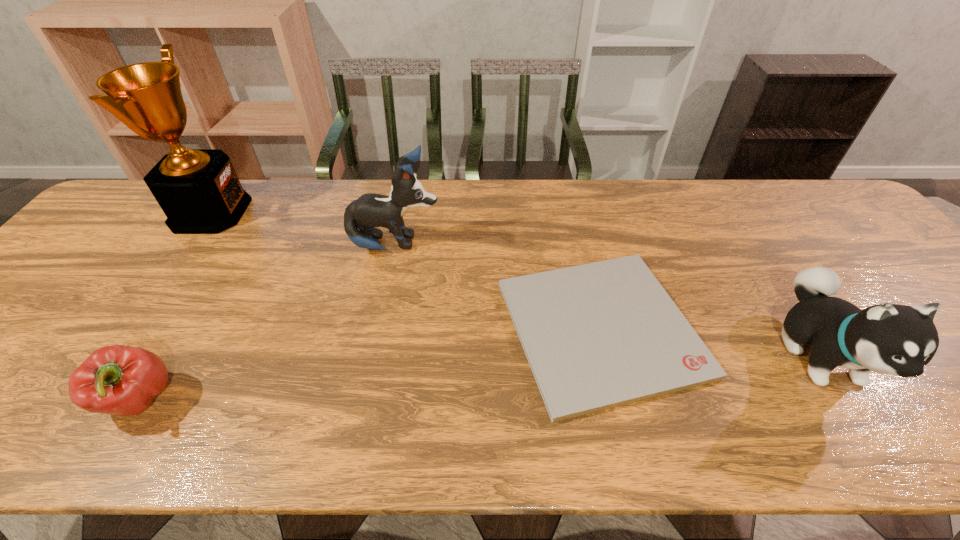
Identify the location of empty location between the trophy cup and the clipboard. Image resolution: width=960 pixels, height=540 pixels. (406, 270).

This screenshot has height=540, width=960. I want to click on vacant point located between the farther puppy and the clipboard, so click(x=498, y=287).

You are a GUI agent. You are given a task and a screenshot of the screen. Output one action in this format:
    pyautogui.click(x=<x>, y=<y>)
    Task: Click on the vacant space that's between the shortest object and the third tallest object
    Image resolution: width=960 pixels, height=540 pixels.
    Given the screenshot: What is the action you would take?
    pyautogui.click(x=710, y=341)

Where is `free space between the tallest object and the fourth tallest object`? free space between the tallest object and the fourth tallest object is located at coordinates (176, 306).

Image resolution: width=960 pixels, height=540 pixels. What are the coordinates of `free space between the fourth tallest object and the tallest object` in the screenshot? It's located at (176, 306).

You are a GUI agent. You are given a task and a screenshot of the screen. Output one action in this format:
    pyautogui.click(x=<x>, y=<y>)
    Task: Click on the vacant area that lies between the tallest object and the farther puppy
    
    Given the screenshot: What is the action you would take?
    pyautogui.click(x=303, y=229)

Locate an element on the screen. This screenshot has width=960, height=540. free space between the second shortest object and the third tallest object is located at coordinates (480, 376).

Where is `unoccupied position between the bell pepper and the shorter puppy`? This screenshot has width=960, height=540. unoccupied position between the bell pepper and the shorter puppy is located at coordinates (480, 376).

You are a GUI agent. You are given a task and a screenshot of the screen. Output one action in this format:
    pyautogui.click(x=<x>, y=<y>)
    Task: Click on the free spot between the bell pepper and the left puppy
    This screenshot has height=540, width=960.
    Given the screenshot: What is the action you would take?
    pyautogui.click(x=268, y=322)

I want to click on the fourth closest object to the tallest object, so click(891, 339).